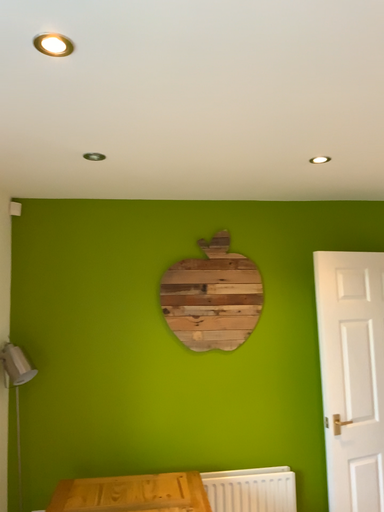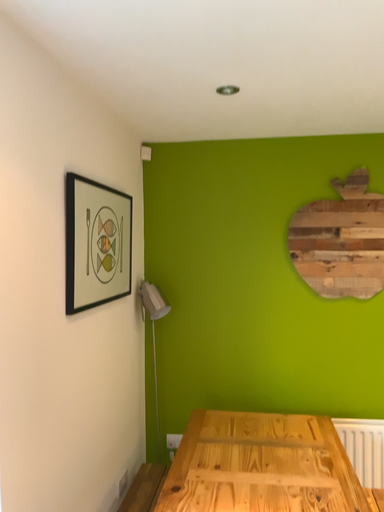
Question: Which way did the camera rotate in the video?

Choices:
 (A) rotated downward
 (B) rotated upward

Answer: (A)